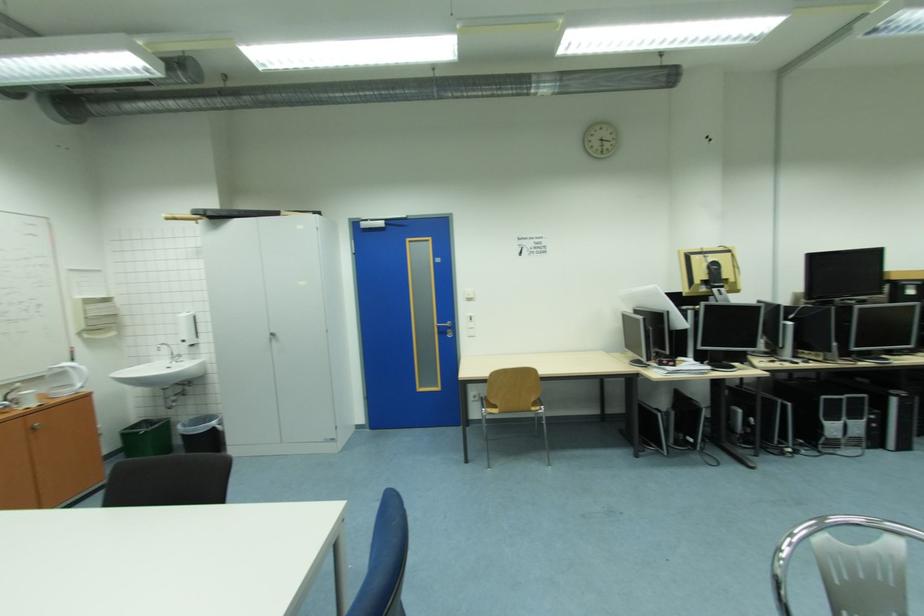
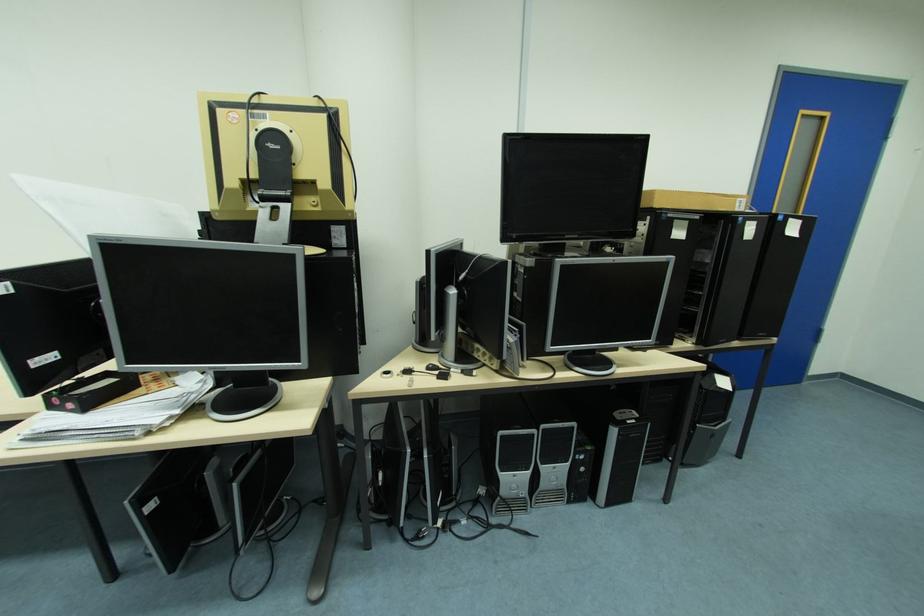
Locate, in the second image, the point that corresponds to (830,398) in the first image.

(507, 434)